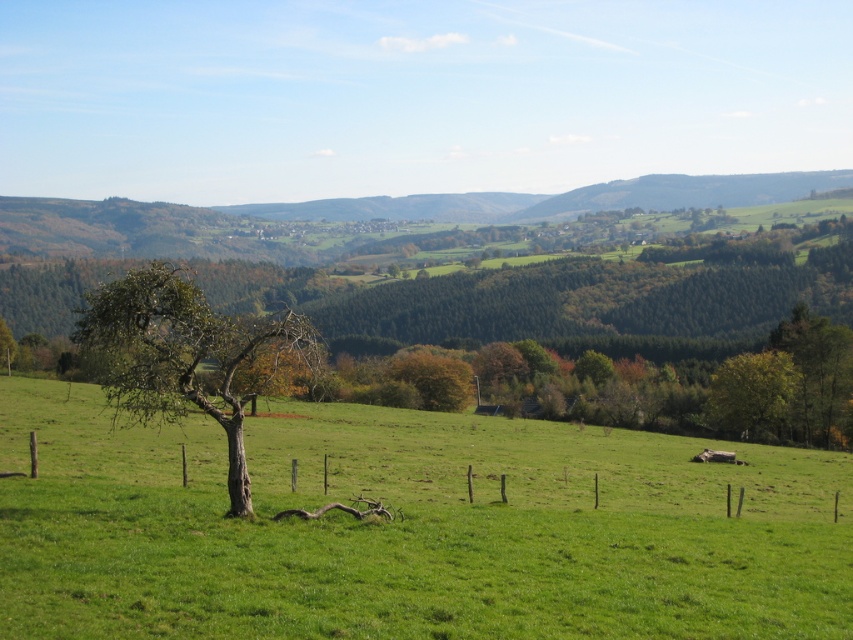
You are standing at the center of the image and want to walk towards the green grassy field at center. Which direction should you move?

The green grassy field at center is already at the center of the image, so you don not need to move in any direction to reach it.

You are a hiker standing in the middle of the field. You see the bare wood tree at left and the green leafy tree at right. Which tree is closer to your left side?

The bare wood tree at left is closer to your left side because it is positioned to the left of the green leafy tree at right.

You are standing in the rural landscape and want to walk from the green grassy field at center to the bare wood tree at left. Which direction should you move to reach it?

The green grassy field at center is in front of the bare wood tree at left, so to reach the tree, you should move backward from the field towards the tree.